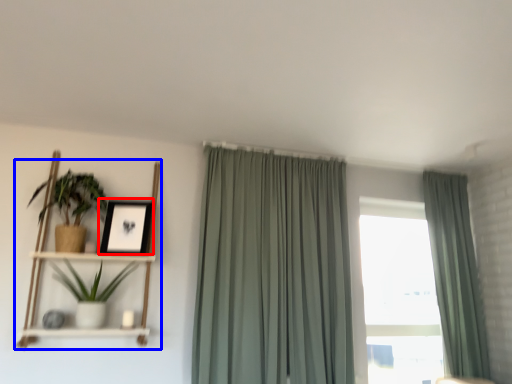
Question: Among these objects, which one is nearest to the camera, picture frame (highlighted by a red box) or shelf (highlighted by a blue box)?

Choices:
 (A) picture frame
 (B) shelf

Answer: (B)